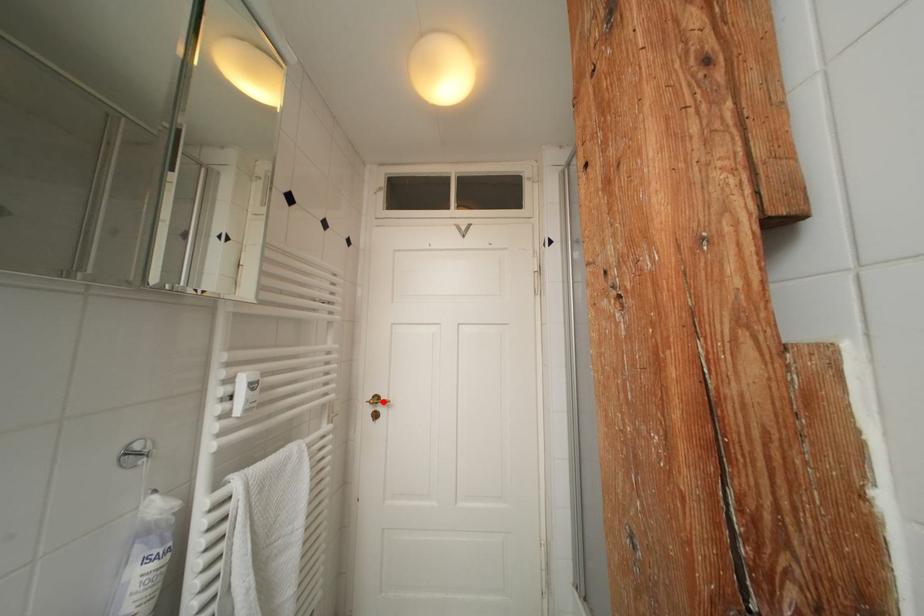
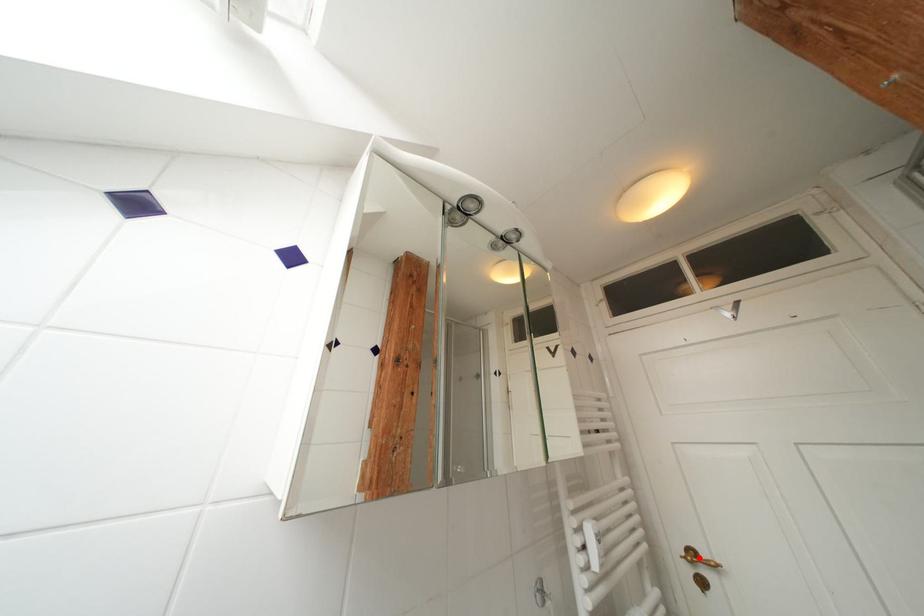
I am providing you with two images of the same scene from different viewpoints. A red point is marked on the first image and another point is marked on the second image. Do the highlighted points in image1 and image2 indicate the same real-world spot?

Yes